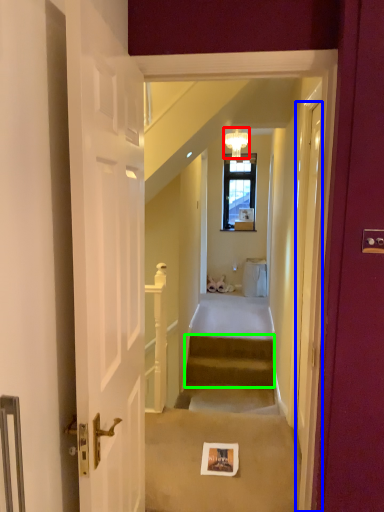
Question: Estimate the real-world distances between objects in this image. Which object is farther from light fixture (highlighted by a red box), door (highlighted by a blue box) or stairs (highlighted by a green box)?

Choices:
 (A) door
 (B) stairs

Answer: (A)